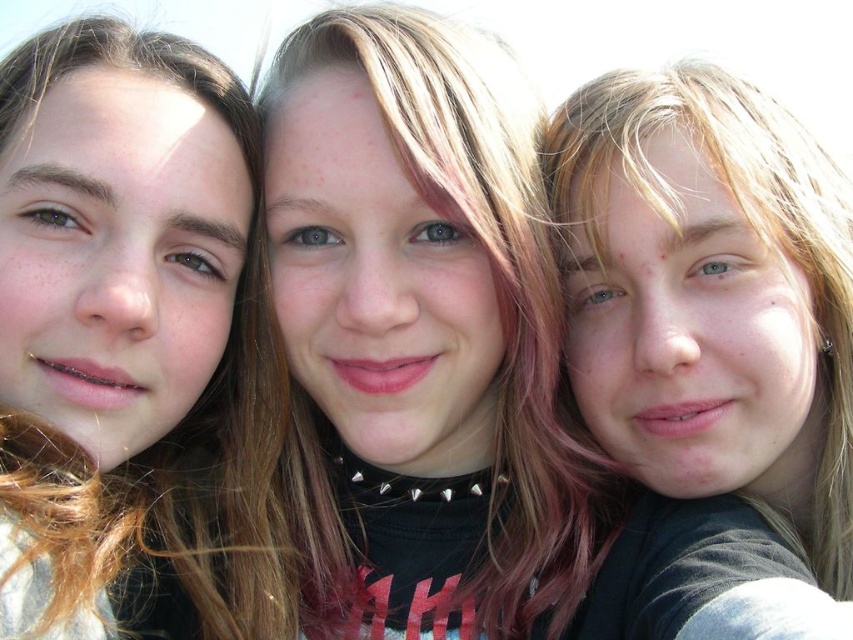
You are trying to identify the clothing and hair details of the person in the center of the group photo. Which item, the matte black shirt at center or the matte black hair at center, occupies a larger area in the image?

The matte black shirt at center is bigger than the matte black hair at center, so the matte black shirt at center occupies a larger area in the image.

You are trying to determine which of the two points in the image is closer to you. The points are labeled as point (322, 172) and point (108, 422). Based on the description, which point is closer?

Point (322, 172) is further to the viewer than point (108, 422). Therefore, point (108, 422) is closer to you.

You are a photographer trying to capture a clear shot of the matte black hair at center without the brown hair at left blocking it. Based on the scene, can you adjust your position to achieve this?

The brown hair at left is in front of matte black hair at center, so moving your position to the right side might allow you to capture the matte black hair at center without obstruction from the brown hair at left.